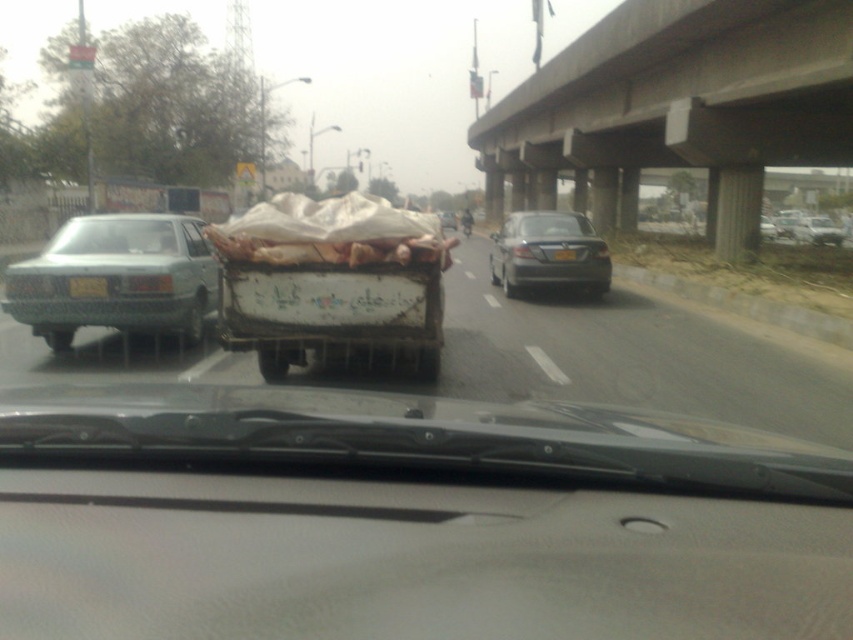
Question: Based on their relative distances, which object is nearer to the yellow plastic license plate at center?

Choices:
 (A) shiny black sedan at center
 (B) white painted wood cart at center

Answer: (A)

Question: Is concrete at upper center below transparent glass windshield at center?

Choices:
 (A) yes
 (B) no

Answer: (B)

Question: Can you confirm if white painted wood cart at center is smaller than shiny black sedan at center?

Choices:
 (A) yes
 (B) no

Answer: (A)

Question: Which point appears closest to the camera in this image?

Choices:
 (A) (67, 228)
 (B) (172, 266)

Answer: (B)

Question: Can you confirm if dirty wooden cart at center is positioned to the left of white painted wood cart at center?

Choices:
 (A) yes
 (B) no

Answer: (B)

Question: Which of the following is the closest to the observer?

Choices:
 (A) concrete at upper center
 (B) yellow plastic license plate at center
 (C) transparent glass windshield at left
 (D) green matte pickup truck at left

Answer: (D)